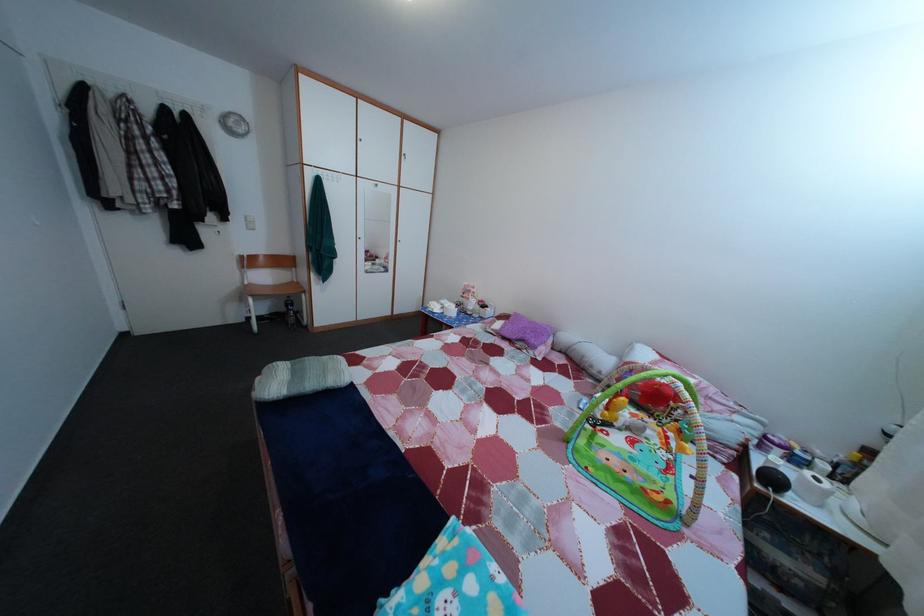
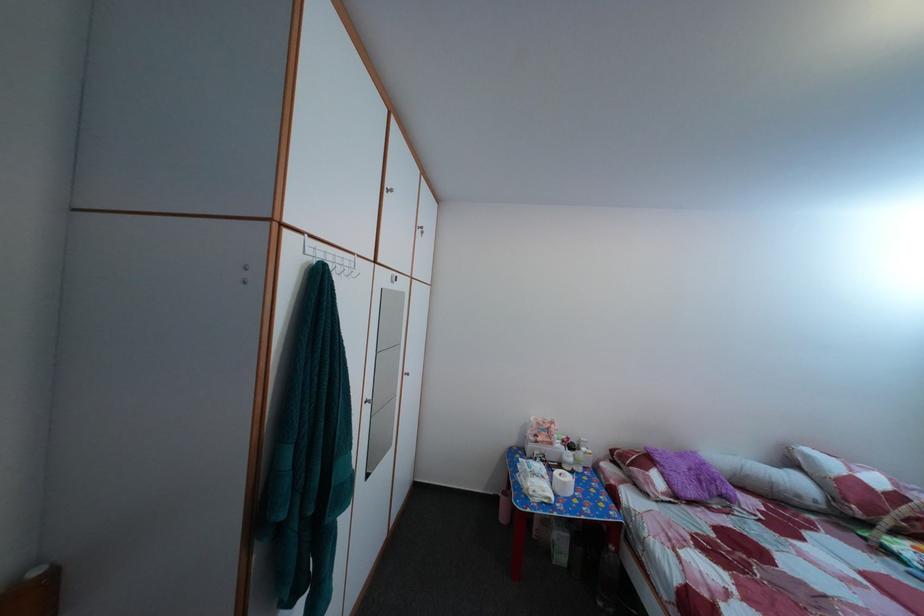
Question: I am providing you with two images of the same scene from different viewpoints. Please identify which objects are invisible in image2.

Choices:
 (A) white cylindrical pillow
 (B) cabinet door knob
 (C) white pump bottle
 (D) none of these

Answer: (D)